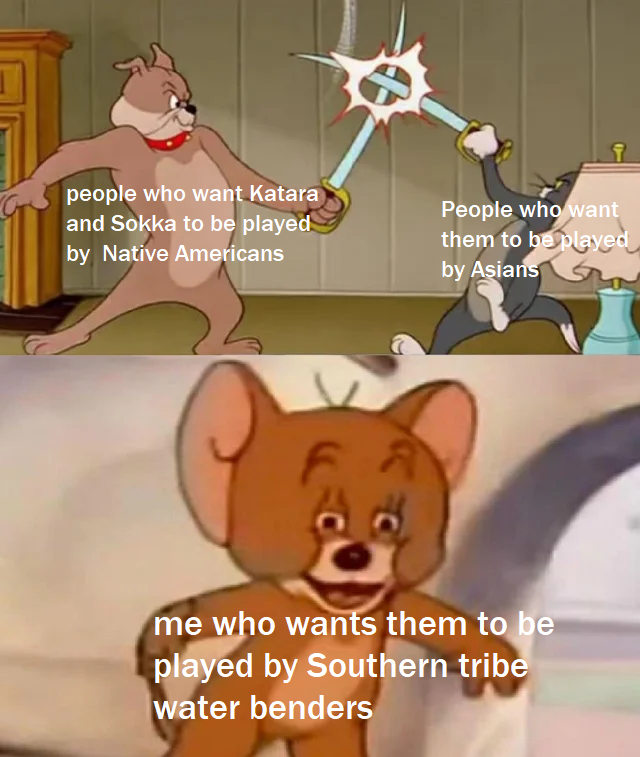
At what (x,y) coordinates should I click in order to perform the action: click on mouse. Please return your answer as a coordinate pair (x, y). The height and width of the screenshot is (757, 640). Looking at the image, I should click on (417, 531).